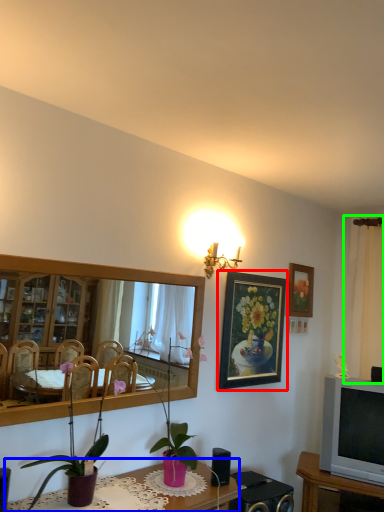
Question: Estimate the real-world distances between objects in this image. Which object is farther from picture frame (highlighted by a red box), table (highlighted by a blue box) or curtain (highlighted by a green box)?

Choices:
 (A) table
 (B) curtain

Answer: (B)